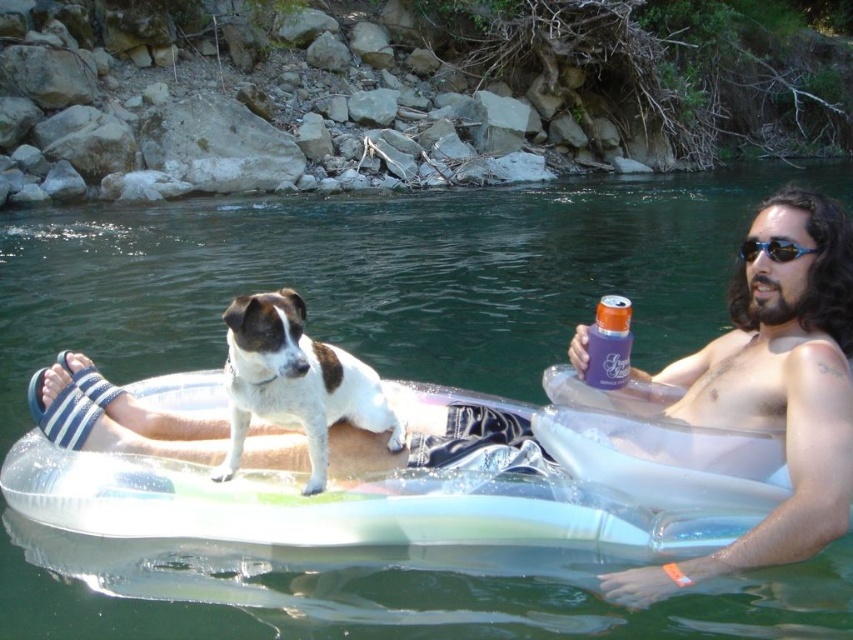
Does point (242, 432) lie in front of point (775, 248)?

No, (242, 432) is behind (775, 248).

Who is more distant from viewer, (225, 323) or (761, 246)?

The point (761, 246) is more distant.

The width and height of the screenshot is (853, 640). What are the coordinates of `white fur dog at center` in the screenshot? It's located at tap(294, 381).